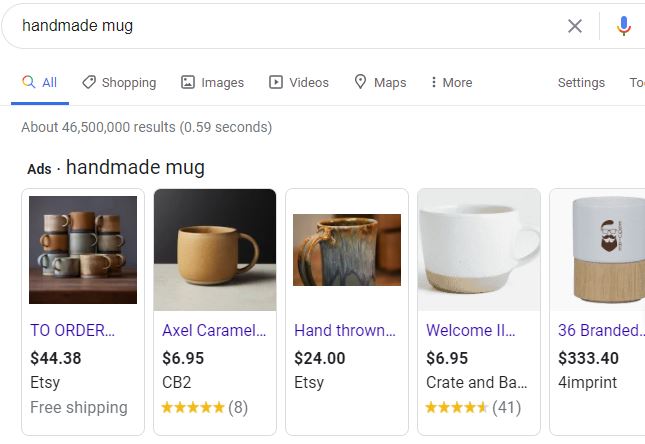
You are a GUI agent. You are given a task and a screenshot of the screen. Output one action in this format:
    pyautogui.click(x=<x>, y=<y>)
    Task: Click on the white/brown mugs
    The height and width of the screenshot is (444, 645).
    Given the screenshot: What is the action you would take?
    [458, 241], [613, 247]